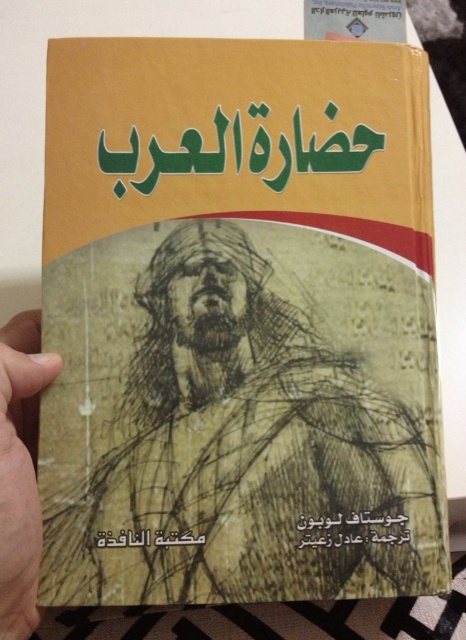
Question: Is skinny flesh at lower left below black paper at center?

Choices:
 (A) yes
 (B) no

Answer: (B)

Question: Can you confirm if skinny flesh at lower left is thinner than black paper at center?

Choices:
 (A) no
 (B) yes

Answer: (B)

Question: Among these points, which one is farthest from the camera?

Choices:
 (A) (18, 396)
 (B) (385, 516)

Answer: (B)

Question: Does skinny flesh at lower left have a smaller size compared to black paper at center?

Choices:
 (A) yes
 (B) no

Answer: (B)

Question: Which of the following is the closest to the observer?

Choices:
 (A) (345, 540)
 (B) (34, 493)

Answer: (B)